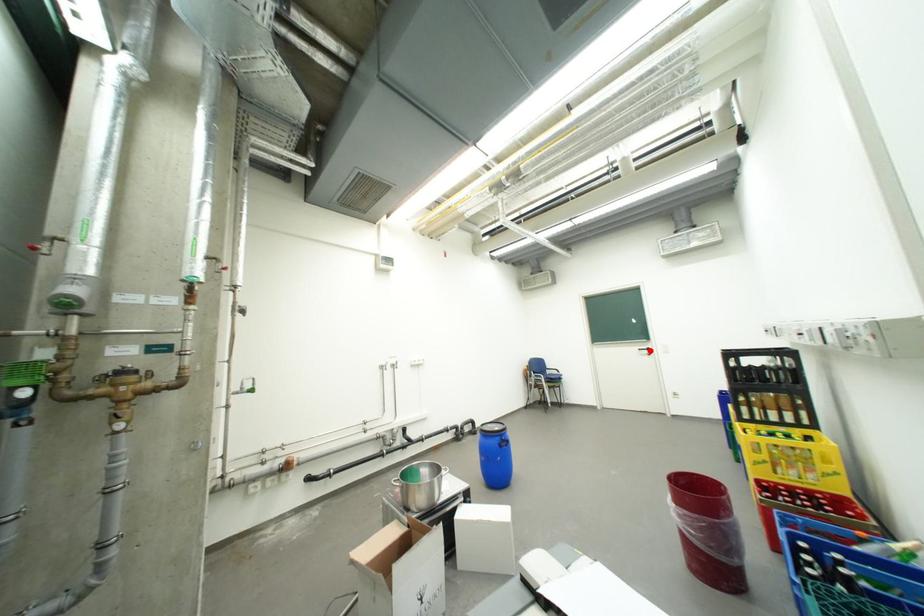
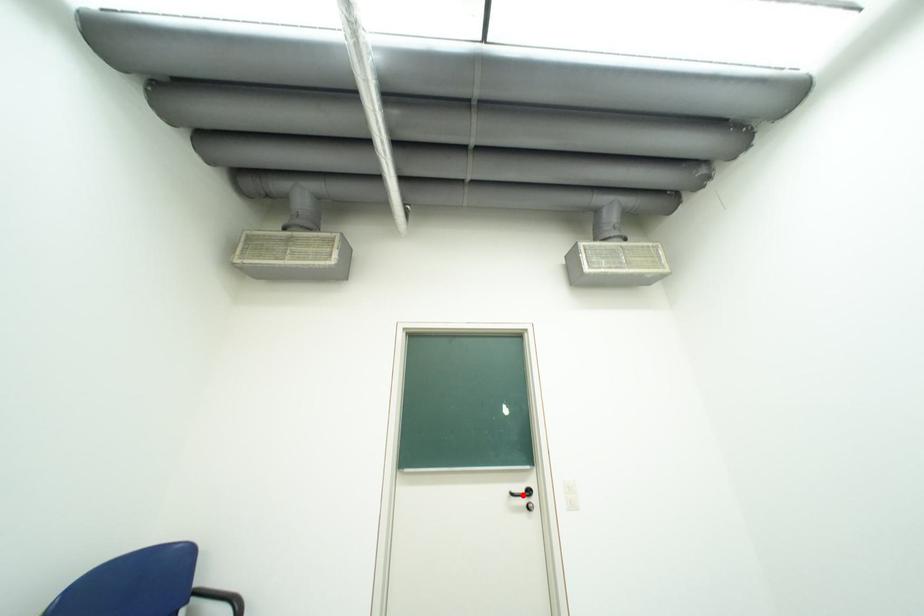
I am providing you with two images of the same scene from different viewpoints. A red point is marked on the first image and another point is marked on the second image. Do the highlighted points in image1 and image2 indicate the same real-world spot?

Yes